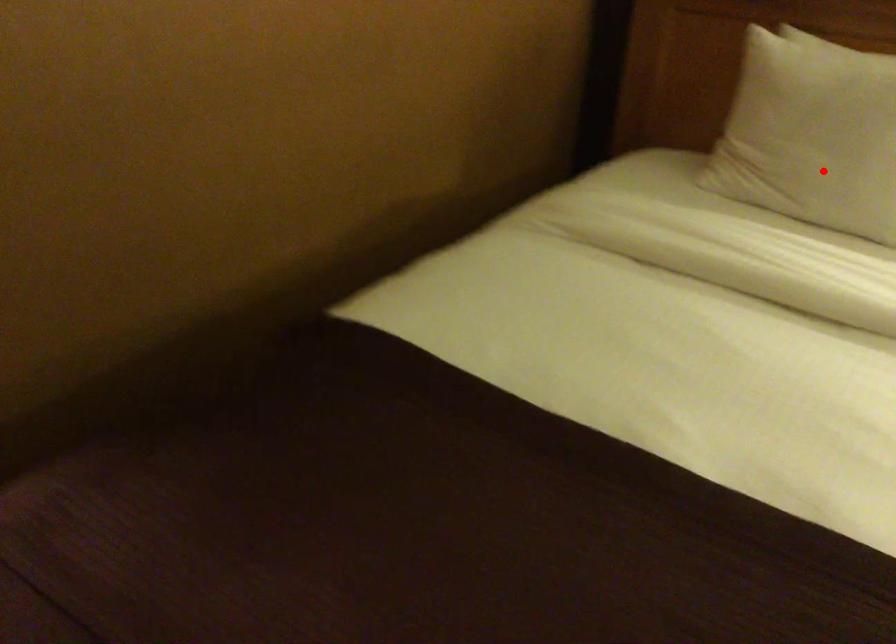
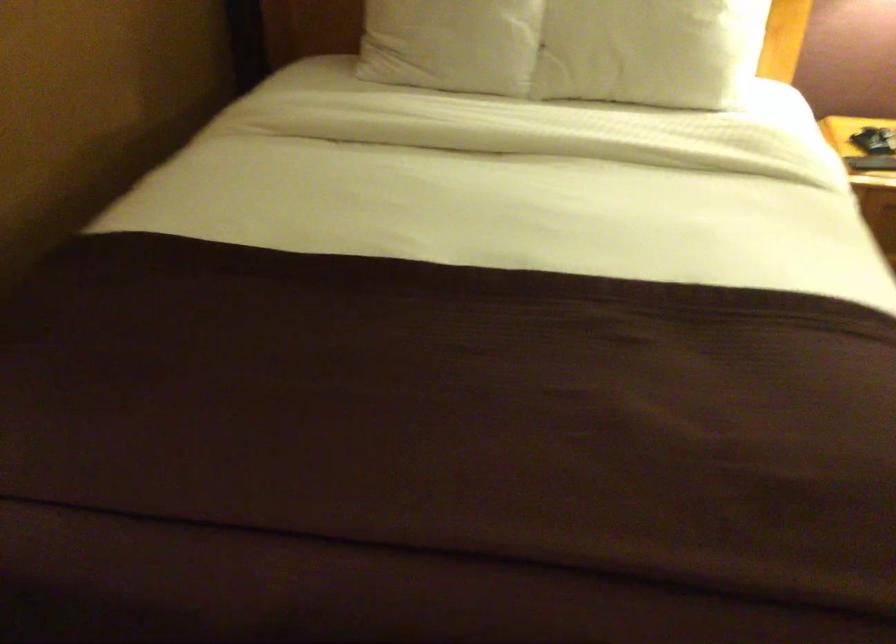
Question: I am providing you with two images of the same scene from different viewpoints. Image1 has a red point marked. In image2, the corresponding 3D location appears at what relative position? Reply with the corresponding letter.

Choices:
 (A) Closer
 (B) Farther

Answer: (B)